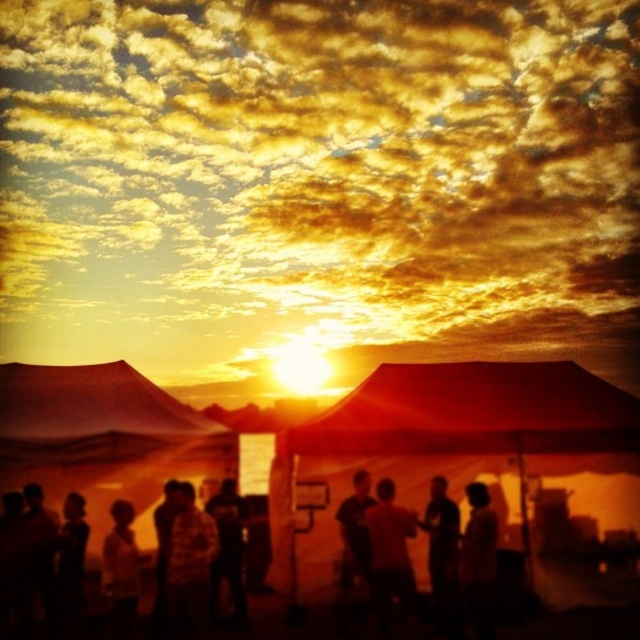
How much distance is there between matte white tent at left and silky black shirt at lower right?

The distance of matte white tent at left from silky black shirt at lower right is 5.29 meters.

Does matte white tent at left lie behind silky black shirt at lower right?

No, it is not.

Measure the distance between point (179, 406) and camera.

They are 13.44 meters apart.

You are a GUI agent. You are given a task and a screenshot of the screen. Output one action in this format:
    pyautogui.click(x=<x>, y=<y>)
    Task: Click on the matte white tent at left
    This screenshot has height=640, width=640.
    Given the screenshot: What is the action you would take?
    pyautogui.click(x=104, y=440)

Is point (372, 538) closer to camera compared to point (106, 552)?

No, it is not.

Between matte white shirt at center and silhouette shirt at lower left, which one is positioned higher?

matte white shirt at center is above.

Describe the element at coordinates (388, 552) in the screenshot. The width and height of the screenshot is (640, 640). I see `matte white shirt at center` at that location.

The width and height of the screenshot is (640, 640). I want to click on matte white shirt at center, so click(388, 552).

Who is lower down, golden textured clouds at upper center or matte white tent at left?

matte white tent at left

Describe the element at coordinates (321, 180) in the screenshot. I see `golden textured clouds at upper center` at that location.

Where is `golden textured clouds at upper center`? golden textured clouds at upper center is located at coordinates (321, 180).